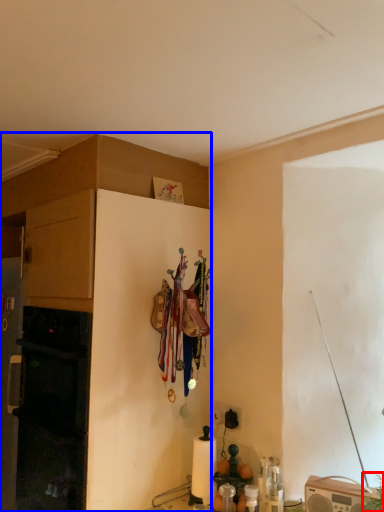
Question: Which object appears farthest to the camera in this image, plant (highlighted by a red box) or cabinetry (highlighted by a blue box)?

Choices:
 (A) plant
 (B) cabinetry

Answer: (B)